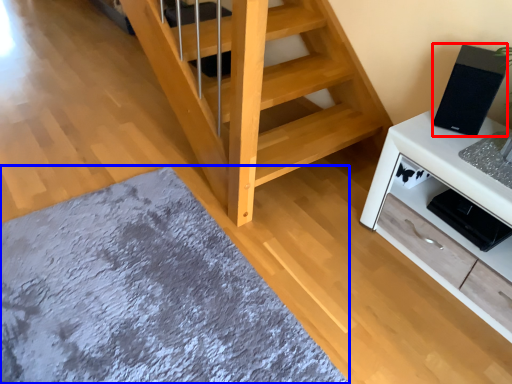
Question: Which of the following is the farthest to the observer, appliance (highlighted by a red box) or mat (highlighted by a blue box)?

Choices:
 (A) appliance
 (B) mat

Answer: (A)